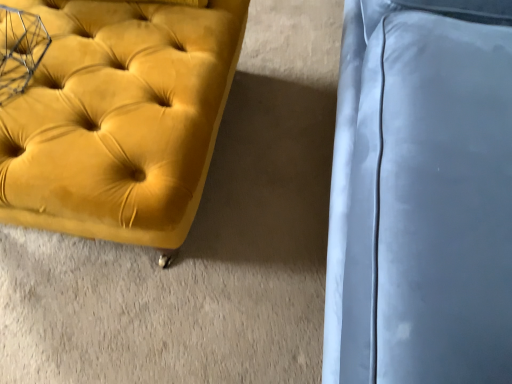
What is the approximate height of velvet yellow ottoman at left?

velvet yellow ottoman at left is 37.08 centimeters tall.

Locate an element on the screen. Image resolution: width=512 pixels, height=384 pixels. velvet yellow ottoman at left is located at coordinates (119, 119).

Describe the element at coordinates (119, 119) in the screenshot. I see `velvet yellow ottoman at left` at that location.

At what (x,y) coordinates should I click in order to perform the action: click on satin blue cushion at right. Please return your answer as a coordinate pair (x, y). The height and width of the screenshot is (384, 512). Looking at the image, I should click on (421, 195).

Image resolution: width=512 pixels, height=384 pixels. What do you see at coordinates (421, 195) in the screenshot? I see `satin blue cushion at right` at bounding box center [421, 195].

What is the approximate height of satin blue cushion at right?

satin blue cushion at right is 31.43 inches tall.

Identify the location of velvet yellow ottoman at left. This screenshot has height=384, width=512. (119, 119).

In the scene shown: Is satin blue cushion at right to the left of velvet yellow ottoman at left from the viewer's perspective?

In fact, satin blue cushion at right is to the right of velvet yellow ottoman at left.

Is satin blue cushion at right positioned behind velvet yellow ottoman at left?

No, satin blue cushion at right is closer to the camera.

Is point (410, 380) in front of point (164, 23)?

Yes, point (410, 380) is in front of point (164, 23).

From the picture: From the image's perspective, is satin blue cushion at right located above or below velvet yellow ottoman at left?

satin blue cushion at right is above velvet yellow ottoman at left.

From a real-world perspective, between satin blue cushion at right and velvet yellow ottoman at left, who is vertically higher?

From a 3D spatial view, satin blue cushion at right is above.

Is satin blue cushion at right wider than velvet yellow ottoman at left?

No.

In terms of height, does satin blue cushion at right look taller or shorter compared to velvet yellow ottoman at left?

Clearly, satin blue cushion at right is taller compared to velvet yellow ottoman at left.

Does satin blue cushion at right have a larger size compared to velvet yellow ottoman at left?

Correct, satin blue cushion at right is larger in size than velvet yellow ottoman at left.

Choose the correct answer: Is satin blue cushion at right inside velvet yellow ottoman at left or outside it?

satin blue cushion at right lies outside velvet yellow ottoman at left.

Would you consider satin blue cushion at right to be distant from velvet yellow ottoman at left?

They are positioned close to each other.

Is satin blue cushion at right oriented towards velvet yellow ottoman at left?

Yes, satin blue cushion at right is facing velvet yellow ottoman at left.

The width and height of the screenshot is (512, 384). What are the coordinates of `swivel chair positioned vertically above the velvet yellow ottoman at left (from a real-world perspective)` in the screenshot? It's located at (421, 195).

Which is more to the left, velvet yellow ottoman at left or satin blue cushion at right?

velvet yellow ottoman at left is more to the left.

Is velvet yellow ottoman at left in front of satin blue cushion at right?

No.

Considering the positions of point (21, 166) and point (467, 191), is point (21, 166) closer or farther from the camera than point (467, 191)?

Point (21, 166).

From the image's perspective, is velvet yellow ottoman at left on satin blue cushion at right?

Incorrect, from the image's perspective, velvet yellow ottoman at left is lower than satin blue cushion at right.

From a real-world perspective, is velvet yellow ottoman at left on top of satin blue cushion at right?

Actually, velvet yellow ottoman at left is physically below satin blue cushion at right in the real world.

Looking at their sizes, would you say velvet yellow ottoman at left is wider or thinner than satin blue cushion at right?

Considering their sizes, velvet yellow ottoman at left looks broader than satin blue cushion at right.

Is velvet yellow ottoman at left taller than satin blue cushion at right?

No, velvet yellow ottoman at left is not taller than satin blue cushion at right.

Considering the sizes of objects velvet yellow ottoman at left and satin blue cushion at right in the image provided, who is bigger, velvet yellow ottoman at left or satin blue cushion at right?

satin blue cushion at right.

Is satin blue cushion at right surrounded by velvet yellow ottoman at left?

Actually, satin blue cushion at right is outside velvet yellow ottoman at left.

Is velvet yellow ottoman at left with satin blue cushion at right?

velvet yellow ottoman at left and satin blue cushion at right are not in contact.

Is satin blue cushion at right at the back of velvet yellow ottoman at left?

No.

Where is `furniture below the satin blue cushion at right (from a real-world perspective)`? Image resolution: width=512 pixels, height=384 pixels. furniture below the satin blue cushion at right (from a real-world perspective) is located at coordinates (119, 119).

At what (x,y) coordinates should I click in order to perform the action: click on swivel chair in front of the velvet yellow ottoman at left. Please return your answer as a coordinate pair (x, y). Image resolution: width=512 pixels, height=384 pixels. Looking at the image, I should click on tap(421, 195).

Locate an element on the screen. The width and height of the screenshot is (512, 384). swivel chair to the right of velvet yellow ottoman at left is located at coordinates (421, 195).